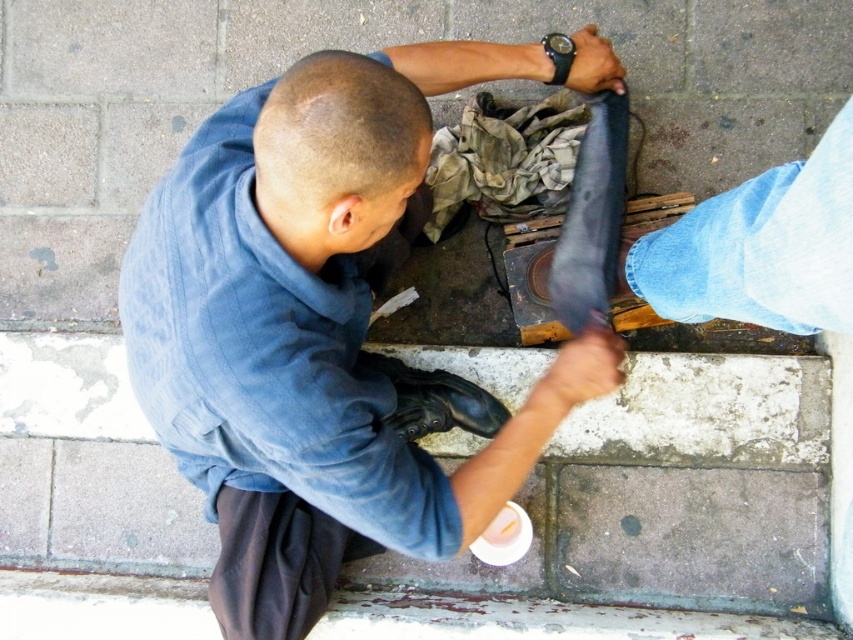
Is smooth leather shoe at lower center shorter than black leather shoe at upper center?

Incorrect, smooth leather shoe at lower center's height does not fall short of black leather shoe at upper center's.

Which is in front, point (616, 340) or point (590, 56)?

Point (616, 340)

Identify the location of smooth leather shoe at lower center. (579, 371).

Is denim jacket at center to the left of black leather shoe at lower center from the viewer's perspective?

Yes, denim jacket at center is to the left of black leather shoe at lower center.

Is denim jacket at center above black leather shoe at lower center?

Correct, denim jacket at center is located above black leather shoe at lower center.

Is point (335, 189) farther from camera compared to point (495, 412)?

No, it is in front of (495, 412).

You are a GUI agent. You are given a task and a screenshot of the screen. Output one action in this format:
    pyautogui.click(x=<x>, y=<y>)
    Task: Click on the denim jacket at center
    
    Given the screenshot: What is the action you would take?
    coord(306,326)

Does black leather shoe at lower center appear under smooth leather shoe at lower center?

Yes.

Does point (492, 420) come behind point (567, 355)?

Yes, point (492, 420) is farther from viewer.

Between point (422, 433) and point (544, 404), which one is positioned behind?

Positioned behind is point (422, 433).

At what (x,y) coordinates should I click in order to perform the action: click on black leather shoe at lower center. Please return your answer as a coordinate pair (x, y). The height and width of the screenshot is (640, 853). Looking at the image, I should click on (436, 401).